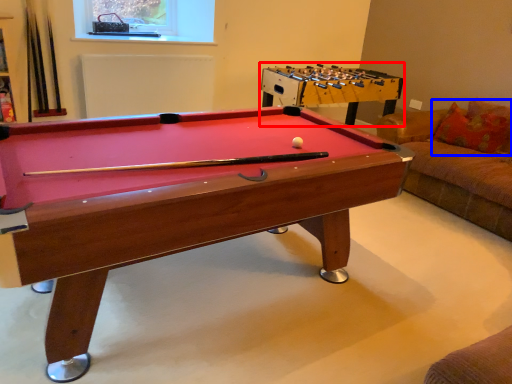
Question: Which object appears closest to the camera in this image, table (highlighted by a red box) or pillow (highlighted by a blue box)?

Choices:
 (A) table
 (B) pillow

Answer: (B)